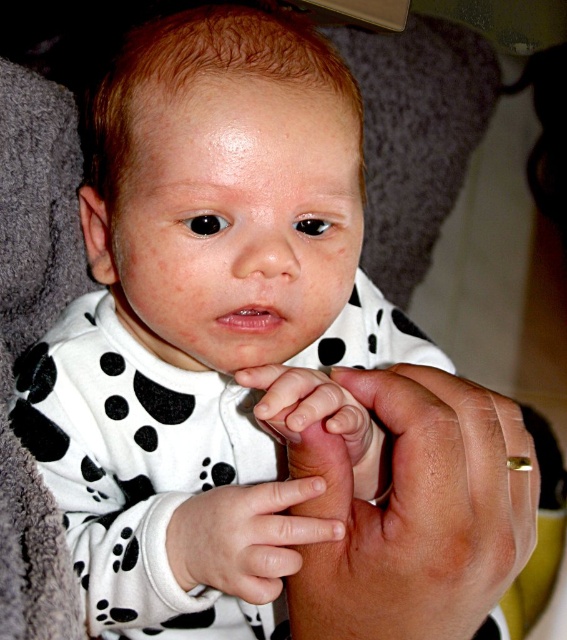
You are a photographer adjusting your camera to focus on two points in the image. The first point is point (x=393, y=458) and the second is point (x=219, y=492). Which point should you focus on first if you want to capture the closest object to the camera?

Point (x=393, y=458) is closer to the viewer than point (x=219, y=492), so you should focus on point (x=393, y=458) first to capture the closest object.

You are a pediatrician examining the baby in the image. You need to determine if the adult hand holding the baby is too large for the baby. Based on the image, what can you conclude about the size comparison between the smooth skin hand at center and the white smooth skin at center?

The smooth skin hand at center is larger than the white smooth skin at center, so the adult hand is appropriately sized for the baby.